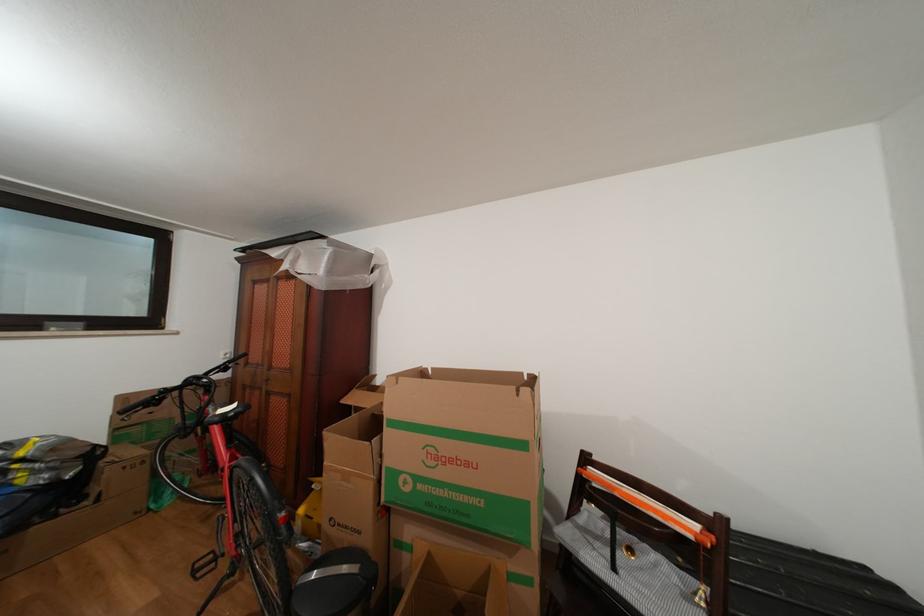
I want to click on small pull bell, so click(628, 551).